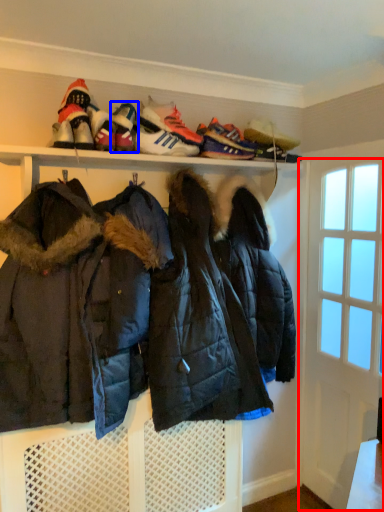
Question: Which object is closer to the camera taking this photo, door (highlighted by a red box) or footwear (highlighted by a blue box)?

Choices:
 (A) door
 (B) footwear

Answer: (B)